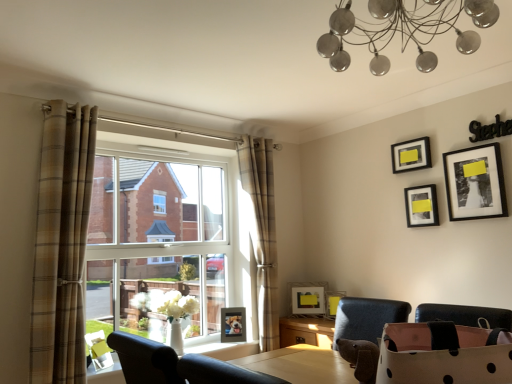
Where is `brown plaid curtain at left, the second curtain from the back`? brown plaid curtain at left, the second curtain from the back is located at coordinates (62, 243).

What do you see at coordinates (233, 324) in the screenshot? The width and height of the screenshot is (512, 384). I see `wooden picture frame at lower center, arranged as the 1th picture frame when viewed from the left` at bounding box center [233, 324].

Image resolution: width=512 pixels, height=384 pixels. I want to click on matte yellow picture frame at lower center, which is the 2th picture frame in left-to-right order, so pos(308,299).

At what (x,y) coordinates should I click in order to perform the action: click on plaid fabric curtain at center, arranged as the second curtain when viewed from the left. Please return your answer as a coordinate pair (x, y). Image resolution: width=512 pixels, height=384 pixels. Looking at the image, I should click on (262, 232).

Image resolution: width=512 pixels, height=384 pixels. What do you see at coordinates (157, 232) in the screenshot?
I see `clear glass window at center` at bounding box center [157, 232].

What do you see at coordinates (176, 365) in the screenshot? I see `velvet black chair at lower center` at bounding box center [176, 365].

This screenshot has height=384, width=512. Find the location of `brown plaid curtain at left, acting as the 2th curtain starting from the right`. brown plaid curtain at left, acting as the 2th curtain starting from the right is located at coordinates (62, 243).

From a real-world perspective, which object rests below the other?

From a 3D spatial view, clear glass window at center is below.

Which of these two, clear glass window at center or metallic chandelier at upper center, is bigger?

clear glass window at center.

From the image's perspective, is clear glass window at center located beneath metallic chandelier at upper center?

Yes.

Is the surface of brown plaid curtain at left, positioned as the 1th curtain in left-to-right order, in direct contact with clear glass window at center?

brown plaid curtain at left, positioned as the 1th curtain in left-to-right order, is not next to clear glass window at center, and they're not touching.

Based on their sizes in the image, would you say brown plaid curtain at left, acting as the 2th curtain starting from the right, is bigger or smaller than clear glass window at center?

brown plaid curtain at left, acting as the 2th curtain starting from the right, is smaller than clear glass window at center.

From the image's perspective, which object appears higher, brown plaid curtain at left, the second curtain from the back, or clear glass window at center?

brown plaid curtain at left, the second curtain from the back, from the image's perspective.

Consider the image. Are metallic chandelier at upper center and matte black picture frame at upper right, the 1th picture frame in the top-to-bottom sequence, beside each other?

No, metallic chandelier at upper center is not in contact with matte black picture frame at upper right, the 1th picture frame in the top-to-bottom sequence.

Can you confirm if metallic chandelier at upper center is positioned to the right of matte black picture frame at upper right, the 3th picture frame when ordered from right to left?

In fact, metallic chandelier at upper center is to the left of matte black picture frame at upper right, the 3th picture frame when ordered from right to left.

Locate an element on the screen. The height and width of the screenshot is (384, 512). light fixture positioned vertically above the matte black picture frame at upper right, the 1th picture frame in the top-to-bottom sequence (from a real-world perspective) is located at coordinates (404, 30).

Is brown plaid curtain at left, positioned as the 1th curtain in left-to-right order, not inside metallic chandelier at upper center?

Absolutely, brown plaid curtain at left, positioned as the 1th curtain in left-to-right order, is external to metallic chandelier at upper center.

Between point (89, 124) and point (411, 22), which one is positioned in front?

The point (411, 22) is more forward.

Is matte yellow picture frame at lower center, arranged as the third picture frame when ordered from the bottom, with black matte picture frame at upper right, the 2th picture frame positioned from the top?

matte yellow picture frame at lower center, arranged as the third picture frame when ordered from the bottom, and black matte picture frame at upper right, the 2th picture frame positioned from the top, are not in contact.

From a real-world perspective, relative to black matte picture frame at upper right, the first picture frame when ordered from right to left, is matte yellow picture frame at lower center, which ranks as the 4th picture frame in top-to-bottom order, vertically above or below?

In terms of real-world spatial position, matte yellow picture frame at lower center, which ranks as the 4th picture frame in top-to-bottom order, is below black matte picture frame at upper right, the first picture frame when ordered from right to left.

Which of these two, matte yellow picture frame at lower center, which ranks as the 4th picture frame in top-to-bottom order, or black matte picture frame at upper right, arranged as the 5th picture frame when ordered from the bottom, is thinner?

Thinner between the two is black matte picture frame at upper right, arranged as the 5th picture frame when ordered from the bottom.

How different are the orientations of matte yellow picture frame at lower center, which ranks as the 4th picture frame in top-to-bottom order, and black matte picture frame at upper right, the 2th picture frame positioned from the top, in degrees?

The angular difference between matte yellow picture frame at lower center, which ranks as the 4th picture frame in top-to-bottom order, and black matte picture frame at upper right, the 2th picture frame positioned from the top, is 44.4 degrees.

From the image's perspective, is matte black picture frame at center, marked as the third picture frame in a left-to-right arrangement, positioned above or below clear glass window at center?

From the image's perspective, matte black picture frame at center, marked as the third picture frame in a left-to-right arrangement, appears below clear glass window at center.

Is clear glass window at center surrounded by matte black picture frame at center, marked as the third picture frame in a left-to-right arrangement?

No, clear glass window at center is not inside matte black picture frame at center, marked as the third picture frame in a left-to-right arrangement.

Considering the relative positions of matte black picture frame at center, which appears as the fourth picture frame when viewed from the right, and clear glass window at center in the image provided, is matte black picture frame at center, which appears as the fourth picture frame when viewed from the right, to the right of clear glass window at center from the viewer's perspective?

Yes.

Between matte yellow picture frame at lower center, which is counted as the fifth picture frame, starting from the right, and metallic chandelier at upper center, which one appears on the right side from the viewer's perspective?

Positioned to the right is metallic chandelier at upper center.

Between matte yellow picture frame at lower center, arranged as the third picture frame when ordered from the bottom, and metallic chandelier at upper center, which one is positioned in front?

metallic chandelier at upper center is closer to the camera.

Does matte yellow picture frame at lower center, which is counted as the fifth picture frame, starting from the right, have a larger size compared to metallic chandelier at upper center?

Incorrect, matte yellow picture frame at lower center, which is counted as the fifth picture frame, starting from the right, is not larger than metallic chandelier at upper center.

From a real-world perspective, who is located lower, matte yellow picture frame at lower center, which is the 2th picture frame in left-to-right order, or metallic chandelier at upper center?

matte yellow picture frame at lower center, which is the 2th picture frame in left-to-right order.

Find the location of a particular element. The height and width of the screenshot is (384, 512). window on the left of metallic chandelier at upper center is located at coordinates (157, 232).

Where is `window below the brown plaid curtain at left, acting as the 2th curtain starting from the right (from a real-world perspective)`? The height and width of the screenshot is (384, 512). window below the brown plaid curtain at left, acting as the 2th curtain starting from the right (from a real-world perspective) is located at coordinates (157, 232).

From the image, which object appears to be farther from matte black picture frame at center-right, placed as the 5th picture frame when sorted from left to right, matte black picture frame at upper right, which ranks as the 4th picture frame in left-to-right order, or clear glass window at center?

clear glass window at center lies further to matte black picture frame at center-right, placed as the 5th picture frame when sorted from left to right, than the other object.

Which object lies further to the anchor point wooden picture frame at lower center, acting as the sixth picture frame starting from the right, black matte picture frame at upper right, marked as the 6th picture frame in a left-to-right arrangement, or brown plaid curtain at left, positioned as the 1th curtain in left-to-right order?

black matte picture frame at upper right, marked as the 6th picture frame in a left-to-right arrangement.

Based on their spatial positions, is metallic chandelier at upper center or matte black picture frame at center-right, the 3th picture frame when ordered from top to bottom, further from black matte picture frame at upper right, arranged as the 5th picture frame when ordered from the bottom?

metallic chandelier at upper center is further to black matte picture frame at upper right, arranged as the 5th picture frame when ordered from the bottom.

When comparing their distances from brown plaid curtain at left, the 1th curtain in the front-to-back sequence, does velvet black chair at lower center or wooden picture frame at lower center, arranged as the 1th picture frame when viewed from the left, seem further?

Among the two, wooden picture frame at lower center, arranged as the 1th picture frame when viewed from the left, is located further to brown plaid curtain at left, the 1th curtain in the front-to-back sequence.

Considering their positions, is clear glass window at center positioned closer to velvet black chair at lower center than matte black picture frame at upper right, the 3th picture frame when ordered from right to left?

clear glass window at center is closer to velvet black chair at lower center.

Based on their spatial positions, is velvet black chair at lower center or plaid fabric curtain at center, the first curtain when ordered from right to left, closer to matte black picture frame at center-right, which is counted as the 2th picture frame, starting from the right?

plaid fabric curtain at center, the first curtain when ordered from right to left, lies closer to matte black picture frame at center-right, which is counted as the 2th picture frame, starting from the right, than the other object.

From the image, which object appears to be farther from clear glass window at center, wooden picture frame at lower center, the 1th picture frame from the bottom, or metallic chandelier at upper center?

Among the two, metallic chandelier at upper center is located further to clear glass window at center.

Based on their spatial positions, is metallic chandelier at upper center or velvet black chair at lower center closer to matte black picture frame at upper right, which ranks as the 4th picture frame in left-to-right order?

Based on the image, metallic chandelier at upper center appears to be nearer to matte black picture frame at upper right, which ranks as the 4th picture frame in left-to-right order.

Where is `curtain located between clear glass window at center and matte black picture frame at center, marked as the third picture frame in a left-to-right arrangement, in the left-right direction`? Image resolution: width=512 pixels, height=384 pixels. curtain located between clear glass window at center and matte black picture frame at center, marked as the third picture frame in a left-to-right arrangement, in the left-right direction is located at coordinates (262, 232).

The image size is (512, 384). Find the location of `window located between brown plaid curtain at left, acting as the 2th curtain starting from the right, and matte black picture frame at center-right, placed as the 5th picture frame when sorted from left to right, in the left-right direction`. window located between brown plaid curtain at left, acting as the 2th curtain starting from the right, and matte black picture frame at center-right, placed as the 5th picture frame when sorted from left to right, in the left-right direction is located at coordinates (157, 232).

Locate an element on the screen. chair between brown plaid curtain at left, acting as the 2th curtain starting from the right, and matte yellow picture frame at lower center, which is counted as the fifth picture frame, starting from the right is located at coordinates (176, 365).

Find the location of a particular element. picture frame between plaid fabric curtain at center, the first curtain when ordered from right to left, and matte black picture frame at center, the 2th picture frame from the bottom, in the horizontal direction is located at coordinates (308, 299).